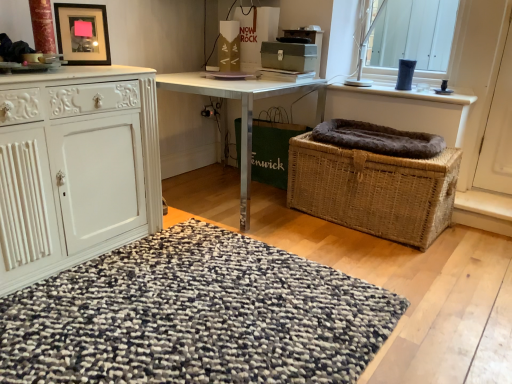
Question: From a real-world perspective, is metallic silver desk at center under textured woolen rug at center?

Choices:
 (A) no
 (B) yes

Answer: (A)

Question: Can you confirm if metallic silver desk at center is shorter than textured woolen rug at center?

Choices:
 (A) yes
 (B) no

Answer: (B)

Question: Can you confirm if metallic silver desk at center is bigger than textured woolen rug at center?

Choices:
 (A) no
 (B) yes

Answer: (B)

Question: Is metallic silver desk at center not inside textured woolen rug at center?

Choices:
 (A) no
 (B) yes

Answer: (B)

Question: Would you consider metallic silver desk at center to be distant from textured woolen rug at center?

Choices:
 (A) no
 (B) yes

Answer: (A)

Question: Considering the relative positions of matte black picture frame at upper left and woven brown picnic basket at lower right in the image provided, is matte black picture frame at upper left to the left or to the right of woven brown picnic basket at lower right?

Choices:
 (A) right
 (B) left

Answer: (B)

Question: Do you think matte black picture frame at upper left is within woven brown picnic basket at lower right, or outside of it?

Choices:
 (A) outside
 (B) inside

Answer: (A)

Question: In terms of size, does matte black picture frame at upper left appear bigger or smaller than woven brown picnic basket at lower right?

Choices:
 (A) big
 (B) small

Answer: (B)

Question: From a real-world perspective, is matte black picture frame at upper left positioned above or below woven brown picnic basket at lower right?

Choices:
 (A) below
 (B) above

Answer: (B)

Question: From their relative heights in the image, would you say woven brown picnic basket at lower right is taller or shorter than metallic silver desk at center?

Choices:
 (A) tall
 (B) short

Answer: (B)

Question: Is woven brown picnic basket at lower right wider or thinner than metallic silver desk at center?

Choices:
 (A) wide
 (B) thin

Answer: (B)

Question: From the image's perspective, is woven brown picnic basket at lower right located above or below metallic silver desk at center?

Choices:
 (A) below
 (B) above

Answer: (A)

Question: In the image, is woven brown picnic basket at lower right positioned in front of or behind metallic silver desk at center?

Choices:
 (A) behind
 (B) front

Answer: (B)

Question: From the image's perspective, relative to textured woolen rug at center, is matte black picture frame at upper left above or below?

Choices:
 (A) below
 (B) above

Answer: (B)

Question: In terms of height, does matte black picture frame at upper left look taller or shorter compared to textured woolen rug at center?

Choices:
 (A) tall
 (B) short

Answer: (A)